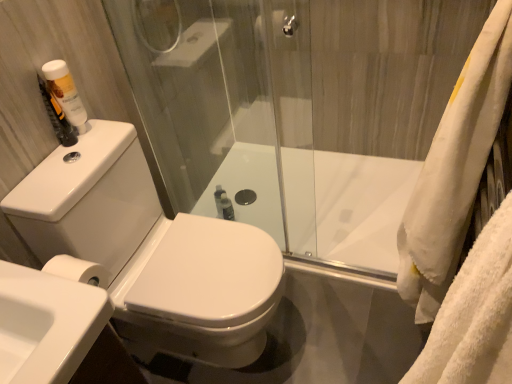
Question: Considering the relative sizes of white plastic bottle at upper left and white fluffy bath towel at right in the image provided, is white plastic bottle at upper left wider than white fluffy bath towel at right?

Choices:
 (A) no
 (B) yes

Answer: (A)

Question: Is white plastic bottle at upper left to the right of white fluffy bath towel at right from the viewer's perspective?

Choices:
 (A) no
 (B) yes

Answer: (A)

Question: Is white plastic bottle at upper left facing away from white fluffy bath towel at right?

Choices:
 (A) yes
 (B) no

Answer: (B)

Question: Considering the relative sizes of white plastic bottle at upper left and white fluffy bath towel at right in the image provided, is white plastic bottle at upper left smaller than white fluffy bath towel at right?

Choices:
 (A) no
 (B) yes

Answer: (B)

Question: Is white fluffy bath towel at right inside white plastic bottle at upper left?

Choices:
 (A) yes
 (B) no

Answer: (B)

Question: Is white plastic bottle at upper left in front of white fluffy bath towel at right?

Choices:
 (A) no
 (B) yes

Answer: (A)

Question: Is white glossy sink at lower left closer to the viewer compared to white glossy bathtub at center?

Choices:
 (A) no
 (B) yes

Answer: (B)

Question: Considering the relative positions of white glossy sink at lower left and white glossy bathtub at center in the image provided, is white glossy sink at lower left to the right of white glossy bathtub at center from the viewer's perspective?

Choices:
 (A) no
 (B) yes

Answer: (A)

Question: From the image's perspective, would you say white glossy sink at lower left is positioned over white glossy bathtub at center?

Choices:
 (A) no
 (B) yes

Answer: (A)

Question: From the image's perspective, is white glossy sink at lower left under white glossy bathtub at center?

Choices:
 (A) yes
 (B) no

Answer: (A)

Question: From a real-world perspective, is white glossy sink at lower left physically above white glossy bathtub at center?

Choices:
 (A) yes
 (B) no

Answer: (A)

Question: Is white glossy sink at lower left bigger than white glossy bathtub at center?

Choices:
 (A) no
 (B) yes

Answer: (A)

Question: Does white fluffy bath towel at right turn towards white plastic bottle at upper left?

Choices:
 (A) no
 (B) yes

Answer: (B)